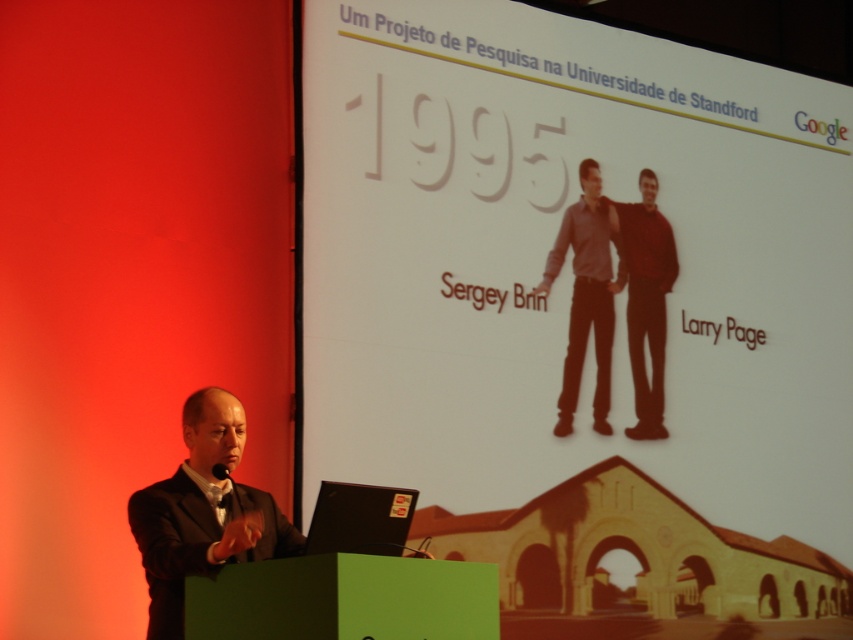
You are an event organizer setting up a stage for a tech conference. You have a dark red sweater at center and a black matte laptop at lower center. Which object is placed higher on the stage?

The dark red sweater at center is positioned over the black matte laptop at lower center, so it is placed higher on the stage.

You are an attendee at this presentation. You notice two items on the screen. One is the white paper at upper center, and the other is the dark red sweater at center. Which of these items is positioned to the left when viewed from your perspective?

The white paper at upper center is positioned to the left of the dark red sweater at center.

You are an event organizer who needs to set up a microphone stand between the dark red sweater at center and the black matte laptop at lower center. Since the microphone stand requires a minimum of 1 meter of space between the two objects to be placed safely, can you determine if there is enough space based on their sizes?

The dark red sweater at center is taller than the black matte laptop at lower center, but the height difference does not provide information about the horizontal distance between them. Therefore, it is impossible to determine if there is enough space for the microphone stand based solely on the given information.